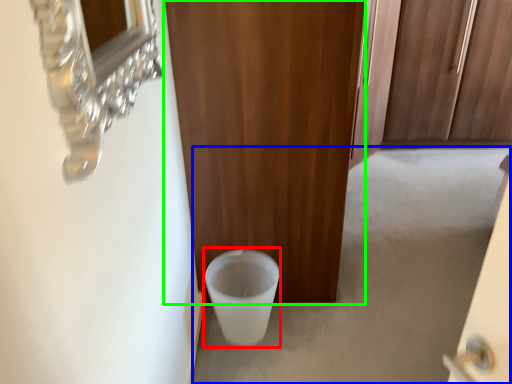
Question: Which object is positioned closest to toilet bowl (highlighted by a red box)? Select from concrete (highlighted by a blue box) and door (highlighted by a green box).

Choices:
 (A) concrete
 (B) door

Answer: (B)